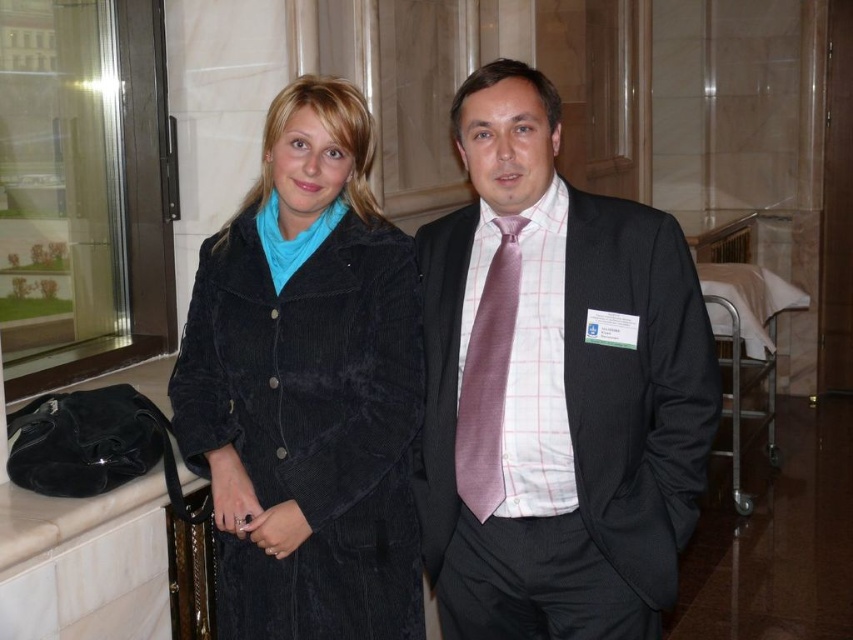
Which of these two, matte black suit at center or corduroy coat at center, stands shorter?

corduroy coat at center is shorter.

Identify the location of matte black suit at center. This screenshot has width=853, height=640. (555, 387).

Which is behind, point (508, 205) or point (309, 355)?

Point (309, 355)

What are the coordinates of `matte black suit at center` in the screenshot? It's located at (555, 387).

Does matte black suit at center appear on the left side of pink silk tie at center?

In fact, matte black suit at center is to the right of pink silk tie at center.

Does point (672, 371) come farther from viewer compared to point (502, 275)?

No, (672, 371) is closer to viewer.

In order to click on matte black suit at center in this screenshot , I will do `click(555, 387)`.

Can you confirm if corduroy coat at center is positioned above pink silk tie at center?

Indeed, corduroy coat at center is positioned over pink silk tie at center.

Which is behind, point (231, 486) or point (492, 458)?

The point (231, 486) is more distant.

This screenshot has width=853, height=640. What are the coordinates of `corduroy coat at center` in the screenshot? It's located at (306, 387).